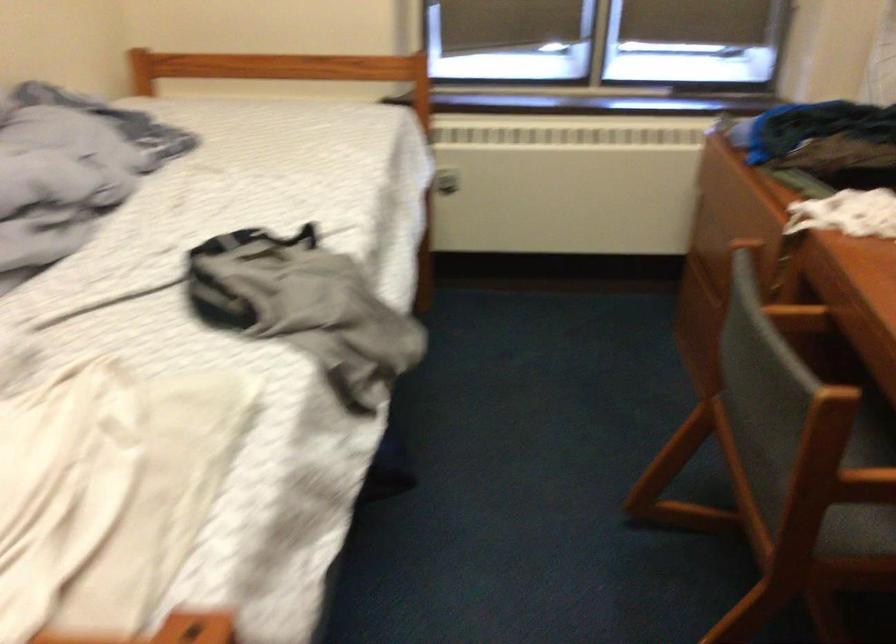
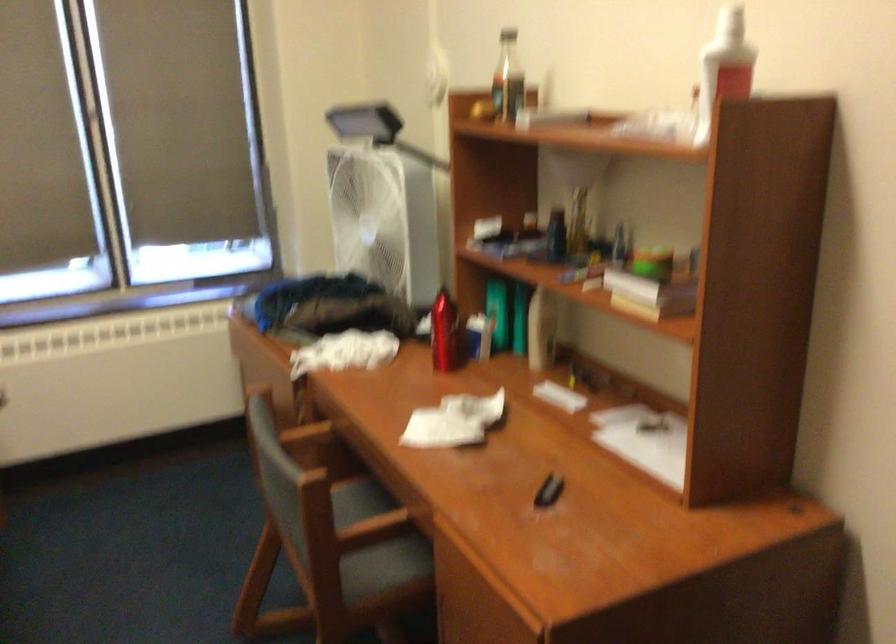
Question: Based on the continuous images, in which direction is the camera rotating? Reply with the corresponding letter.

Choices:
 (A) Left
 (B) Right
 (C) Up
 (D) Down

Answer: (B)